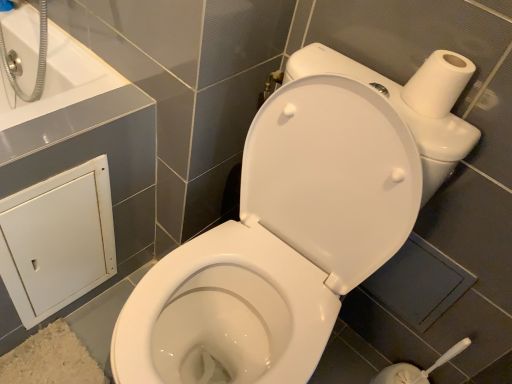
Question: Is white matte toilet paper at upper right to the left or to the right of white glossy bathtub at upper left in the image?

Choices:
 (A) left
 (B) right

Answer: (B)

Question: Based on their sizes in the image, would you say white matte toilet paper at upper right is bigger or smaller than white glossy bathtub at upper left?

Choices:
 (A) big
 (B) small

Answer: (B)

Question: Estimate the real-world distances between objects in this image. Which object is farther from the white glossy bathtub at upper left?

Choices:
 (A) white glossy toilet at center
 (B) white matte cabinet at lower left
 (C) white matte toilet paper at upper right
 (D) dark gray tile at lower right

Answer: (D)

Question: Estimate the real-world distances between objects in this image. Which object is farther from the dark gray tile at lower right?

Choices:
 (A) white glossy toilet at center
 (B) white matte toilet paper at upper right
 (C) white matte cabinet at lower left
 (D) white glossy bathtub at upper left

Answer: (D)